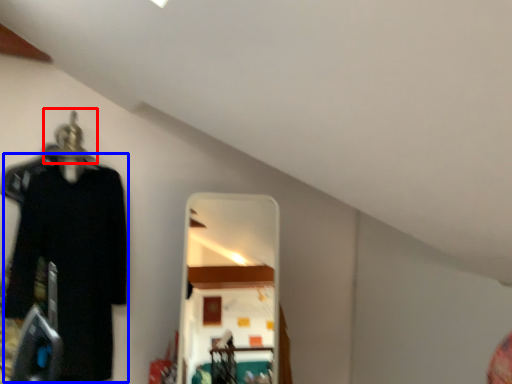
Question: Among these objects, which one is nearest to the camera, hanger (highlighted by a red box) or clothing (highlighted by a blue box)?

Choices:
 (A) hanger
 (B) clothing

Answer: (B)